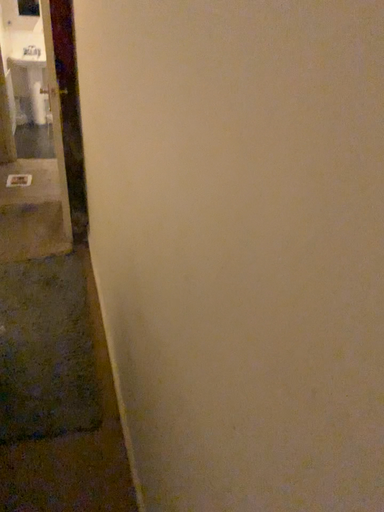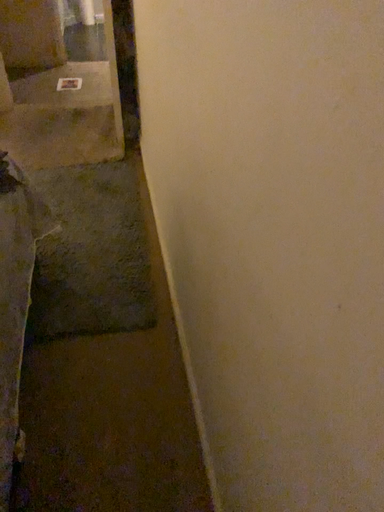
Question: Which way did the camera rotate in the video?

Choices:
 (A) rotated downward
 (B) rotated upward

Answer: (A)